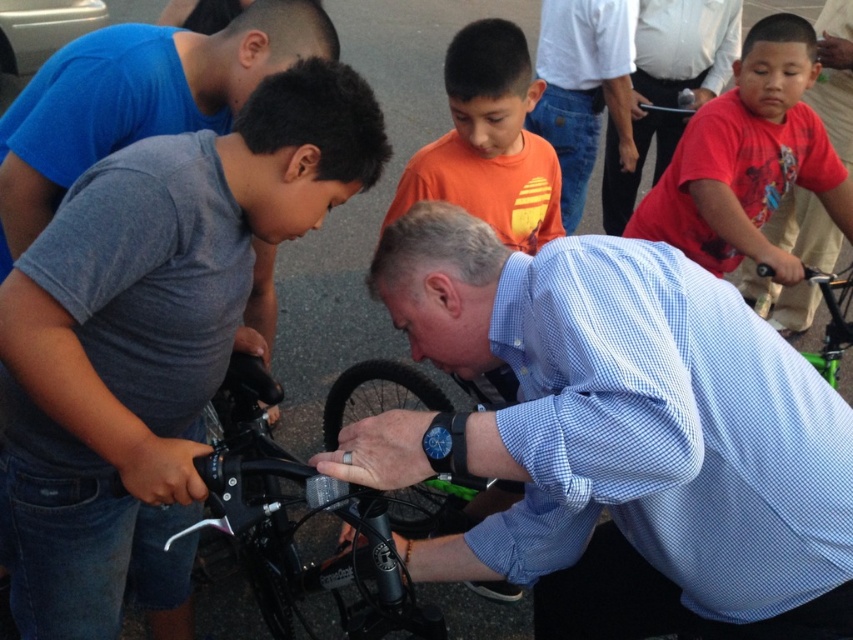
Does red cotton shirt at right lie behind matte red shirt at right?

That is False.

Locate an element on the screen. This screenshot has width=853, height=640. red cotton shirt at right is located at coordinates (747, 160).

Does point (601, 256) come behind point (375, 556)?

No, (601, 256) is closer to viewer.

Is the position of blue checkered shirt at center less distant than that of shiny metallic bicycle handlebar at center?

Yes, blue checkered shirt at center is closer to the viewer.

Find the location of a particular element. blue checkered shirt at center is located at coordinates (630, 436).

Is gray matte shirt at left wider than white shirt at upper center?

Correct, the width of gray matte shirt at left exceeds that of white shirt at upper center.

Can you confirm if gray matte shirt at left is taller than white shirt at upper center?

Yes, gray matte shirt at left is taller than white shirt at upper center.

What do you see at coordinates (151, 342) in the screenshot? I see `gray matte shirt at left` at bounding box center [151, 342].

This screenshot has width=853, height=640. Find the location of `gray matte shirt at left`. gray matte shirt at left is located at coordinates (151, 342).